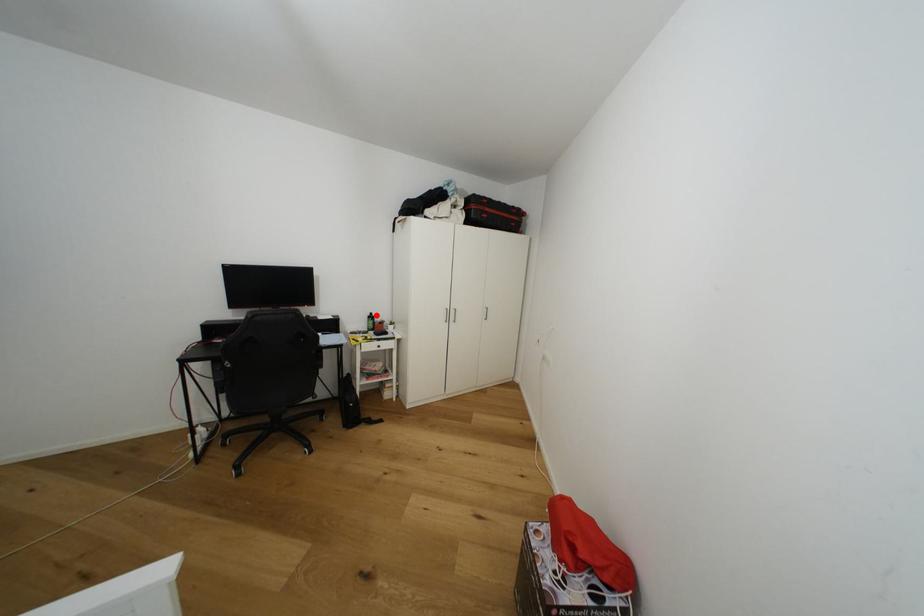
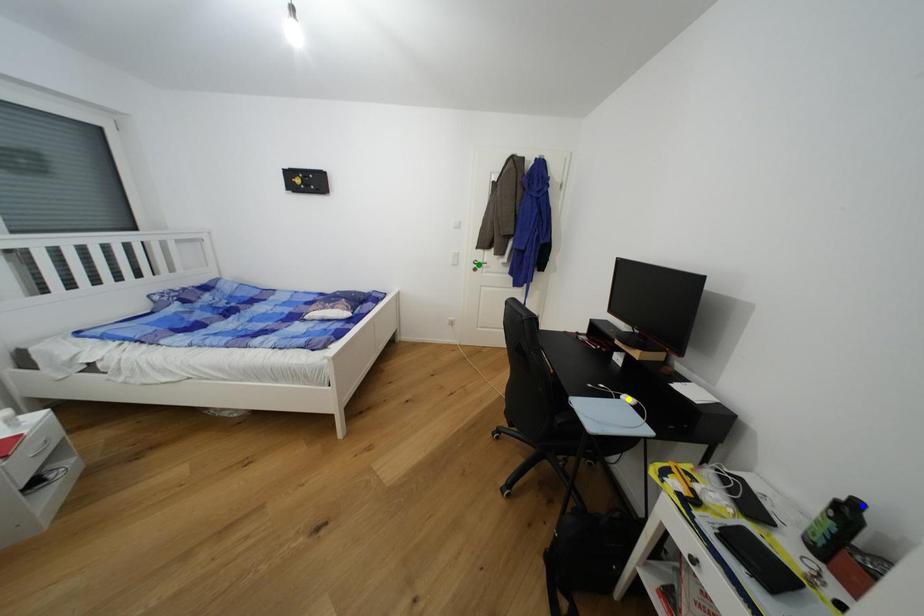
Question: I am providing you with two images of the same scene from different viewpoints. A red point is marked on the first image. You are given multiple points on the second image. Which spot in image 2 lines up with the point in image 1?

Choices:
 (A) yellow point
 (B) blue point
 (C) green point

Answer: (B)